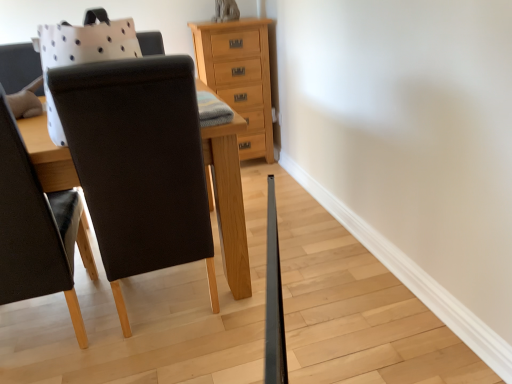
Question: Is matte black chair at left wider or thinner than natural wood chest of drawers at upper center?

Choices:
 (A) wide
 (B) thin

Answer: (A)

Question: Is matte black chair at left to the left or to the right of natural wood chest of drawers at upper center in the image?

Choices:
 (A) right
 (B) left

Answer: (B)

Question: Considering the real-world distances, which object is closest to the wooden table at center?

Choices:
 (A) matte black chair at left
 (B) natural wood chest of drawers at upper center

Answer: (A)

Question: Based on their relative distances, which object is nearer to the wooden table at center?

Choices:
 (A) matte black chair at left
 (B) natural wood chest of drawers at upper center

Answer: (A)